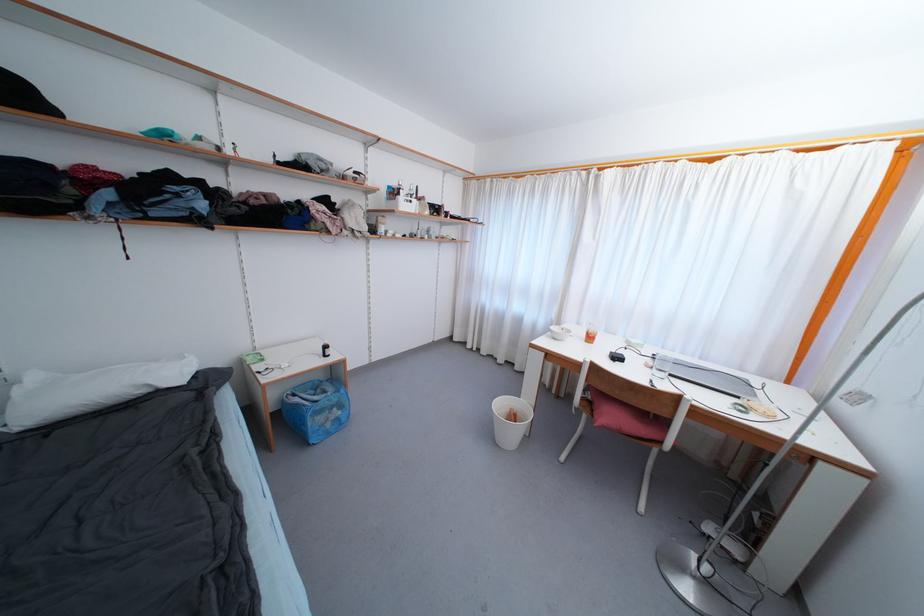
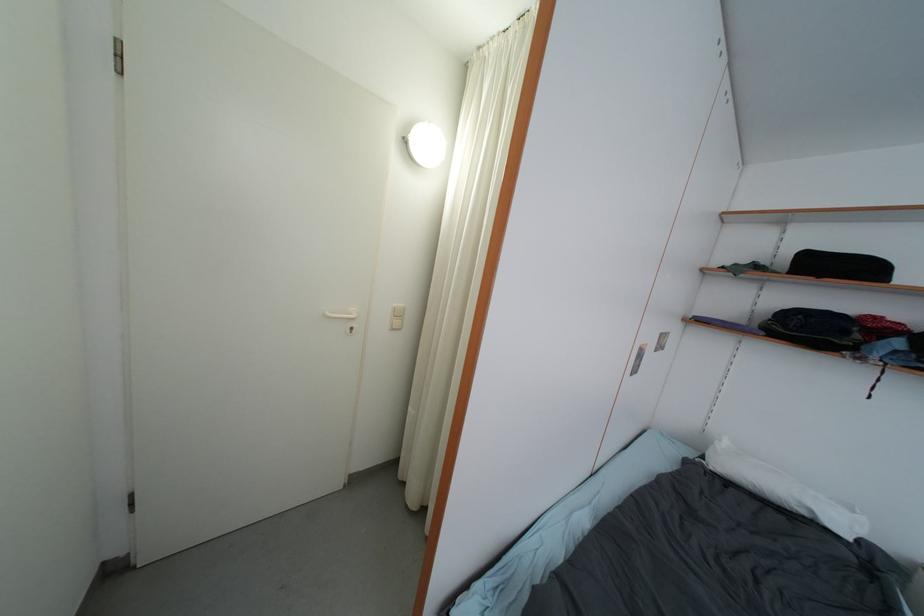
Question: The images are taken continuously from a first-person perspective. In which direction is your viewpoint rotating?

Choices:
 (A) Left
 (B) Right
 (C) Up
 (D) Down

Answer: (A)